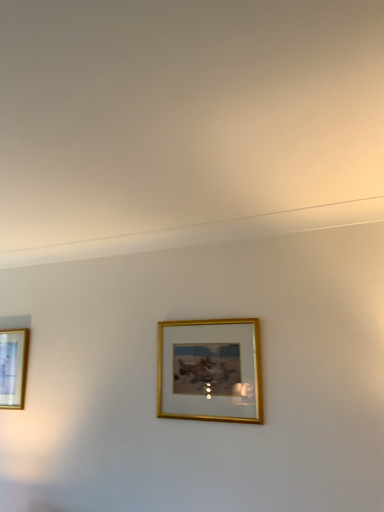
Question: Which direction should I rotate to look at gold metallic picture frame at center, which is the second picture frame in back-to-front order, — up or down?

Choices:
 (A) up
 (B) down

Answer: (B)

Question: Is gold-framed picture at left, arranged as the first picture frame when viewed from the left, further to camera compared to gold metallic picture frame at center, the 2th picture frame positioned from the left?

Choices:
 (A) yes
 (B) no

Answer: (A)

Question: Does gold-framed picture at left, which is the second picture frame from right to left, have a greater width compared to gold metallic picture frame at center, placed as the first picture frame when sorted from front to back?

Choices:
 (A) no
 (B) yes

Answer: (A)

Question: Would you say gold-framed picture at left, arranged as the first picture frame when viewed from the left, contains gold metallic picture frame at center, placed as the first picture frame when sorted from front to back?

Choices:
 (A) yes
 (B) no

Answer: (B)

Question: Is gold-framed picture at left, which is counted as the 2th picture frame, starting from the front, positioned in front of gold metallic picture frame at center, placed as the first picture frame when sorted from front to back?

Choices:
 (A) yes
 (B) no

Answer: (B)

Question: Considering the relative positions of gold-framed picture at left, which is counted as the 2th picture frame, starting from the front, and gold metallic picture frame at center, placed as the first picture frame when sorted from front to back, in the image provided, is gold-framed picture at left, which is counted as the 2th picture frame, starting from the front, to the left of gold metallic picture frame at center, placed as the first picture frame when sorted from front to back, from the viewer's perspective?

Choices:
 (A) yes
 (B) no

Answer: (A)

Question: From a real-world perspective, does gold-framed picture at left, which is the second picture frame from right to left, sit lower than gold metallic picture frame at center, which is the second picture frame in back-to-front order?

Choices:
 (A) yes
 (B) no

Answer: (A)

Question: From a real-world perspective, is gold metallic picture frame at center, which is the second picture frame in back-to-front order, positioned under gold-framed picture at left, the 1th picture frame positioned from the back, based on gravity?

Choices:
 (A) yes
 (B) no

Answer: (B)

Question: Does gold metallic picture frame at center, placed as the first picture frame when sorted from front to back, have a lesser height compared to gold-framed picture at left, which is the second picture frame from right to left?

Choices:
 (A) no
 (B) yes

Answer: (B)

Question: Considering the relative positions of gold metallic picture frame at center, which is the second picture frame in back-to-front order, and gold-framed picture at left, which is the second picture frame from right to left, in the image provided, is gold metallic picture frame at center, which is the second picture frame in back-to-front order, behind gold-framed picture at left, which is the second picture frame from right to left,?

Choices:
 (A) yes
 (B) no

Answer: (B)

Question: Considering the relative sizes of gold metallic picture frame at center, which is the second picture frame in back-to-front order, and gold-framed picture at left, which is the second picture frame from right to left, in the image provided, is gold metallic picture frame at center, which is the second picture frame in back-to-front order, wider than gold-framed picture at left, which is the second picture frame from right to left,?

Choices:
 (A) no
 (B) yes

Answer: (B)

Question: Is gold metallic picture frame at center, which is the second picture frame in back-to-front order, taller than gold-framed picture at left, which is counted as the 2th picture frame, starting from the front?

Choices:
 (A) yes
 (B) no

Answer: (B)

Question: Does gold metallic picture frame at center, the 2th picture frame positioned from the left, lie in front of gold-framed picture at left, which is counted as the 2th picture frame, starting from the front?

Choices:
 (A) no
 (B) yes

Answer: (B)

Question: From the image's perspective, is gold-framed picture at left, which is counted as the 2th picture frame, starting from the front, positioned above or below gold metallic picture frame at center, the 2th picture frame positioned from the left?

Choices:
 (A) below
 (B) above

Answer: (A)